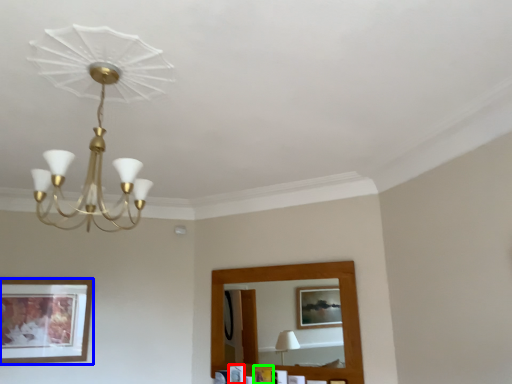
Question: Based on their relative distances, which object is nearer to picture frame (highlighted by a red box)? Choose from picture frame (highlighted by a blue box) and picture frame (highlighted by a green box).

Choices:
 (A) picture frame
 (B) picture frame

Answer: (B)